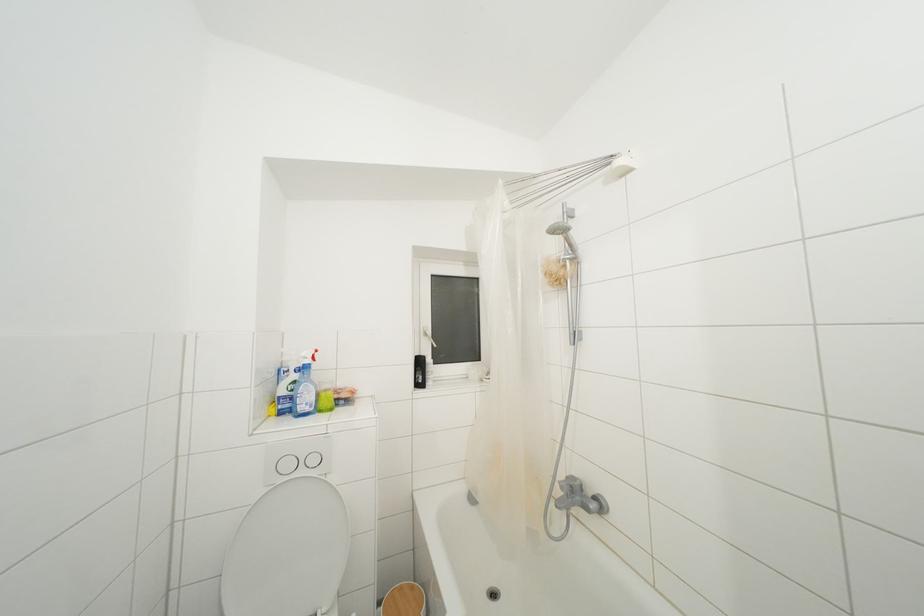
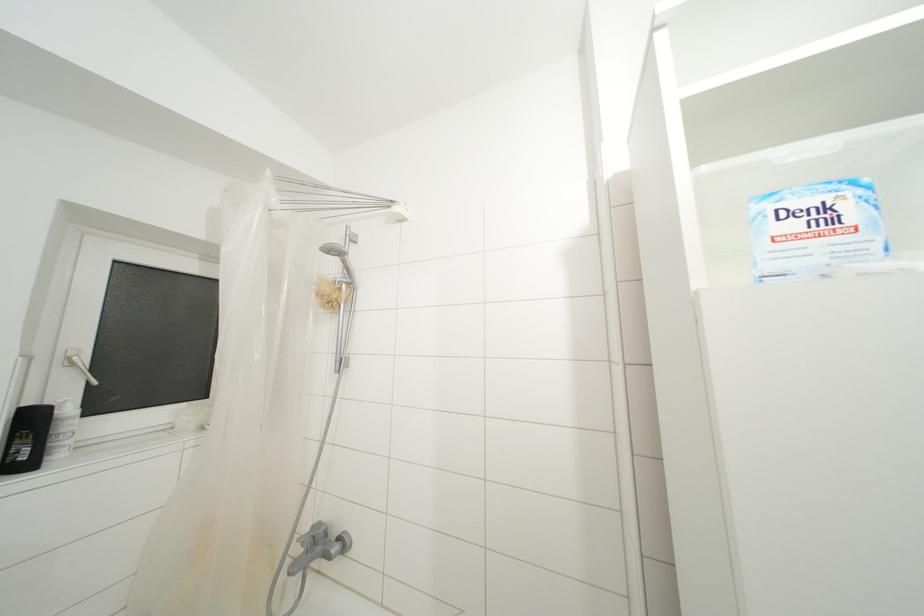
Question: The camera is either moving clockwise (left) or counter-clockwise (right) around the object. The first image is from the beginning of the video and the second image is from the end. Is the camera moving left or right when shooting the video?

Choices:
 (A) Left
 (B) Right

Answer: (A)